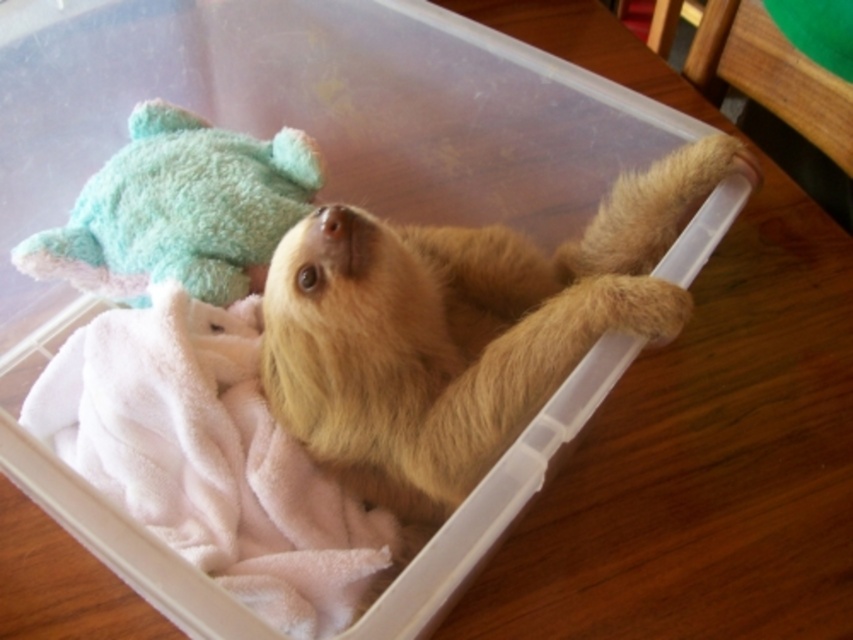
You are a zookeeper who needs to ensure the fuzzy golden sloth at center has enough space in its enclosure. Given that the enclosure is only 10 cm taller than the teal plush toy at upper left, will the sloth fit comfortably?

The fuzzy golden sloth at center is taller than the teal plush toy at upper left. Since the enclosure is only 10 cm taller than the teal plush toy at upper left, the enclosure may not be tall enough to accommodate the sloth comfortably. The sloth requires more vertical space than what is currently available.

You are a zookeeper who needs to place a new toy for the baby sloth. The toy must be positioned so that it is closer to the fuzzy golden sloth at center than the teal plush toy at upper left. Where should you place the new toy?

The new toy should be placed closer to the fuzzy golden sloth at center than the teal plush toy at upper left. Since the fuzzy golden sloth at center is already closer to the viewer, positioning the new toy near it would satisfy the requirement.

You are observing a baby sloth in a container. There are two points marked in the image. The first point is at coordinate point(726, 170) and the second is at point(115, 188). From your perspective, which point is closer to you?

Point(726, 170) is closer to the camera than point(115, 188).